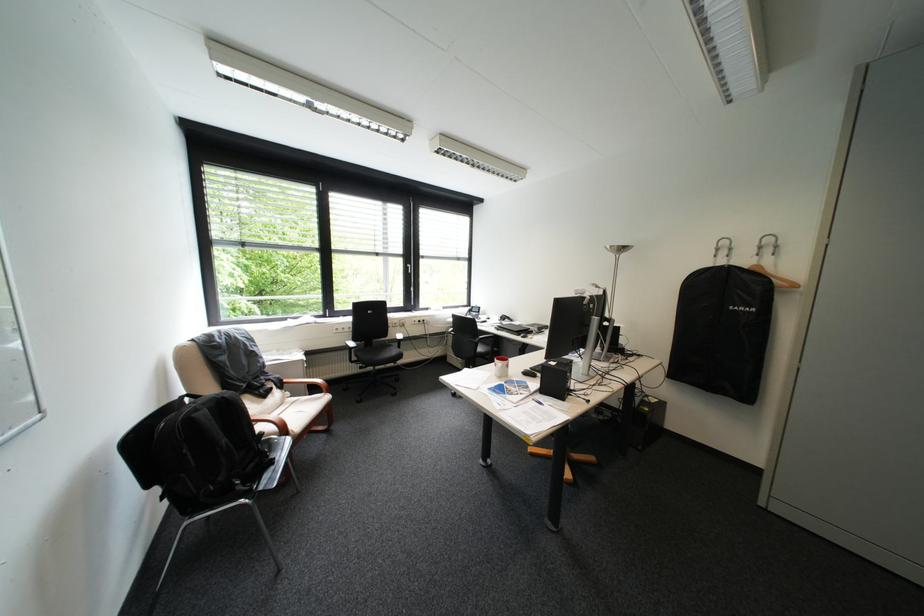
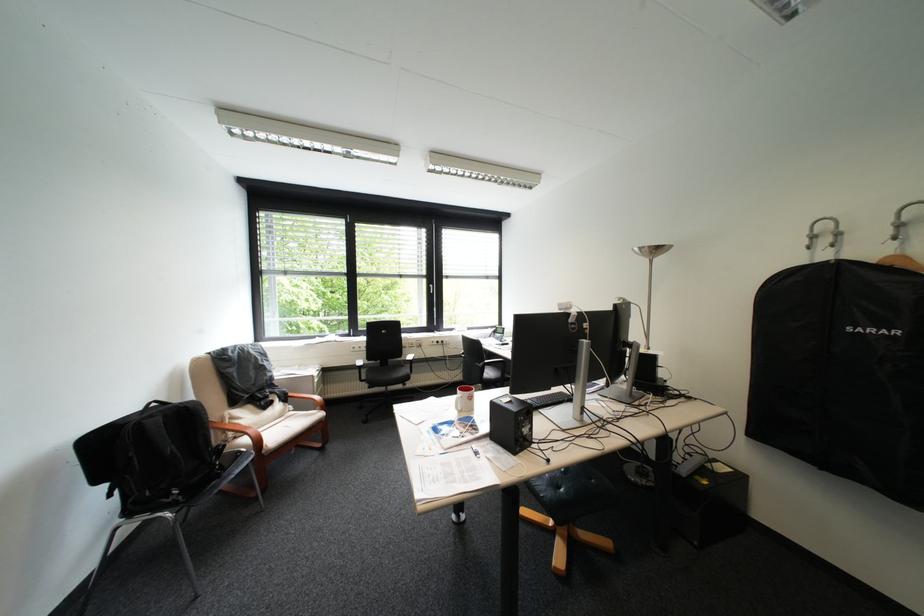
Question: The camera is either moving clockwise (left) or counter-clockwise (right) around the object. The first image is from the beginning of the video and the second image is from the end. Is the camera moving left or right when shooting the video?

Choices:
 (A) Left
 (B) Right

Answer: (B)